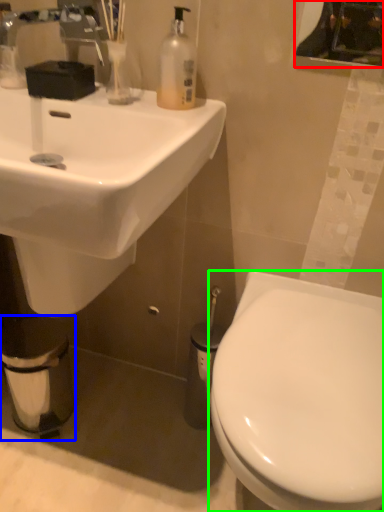
Question: Which object is positioned closest to mirror (highlighted by a red box)? Select from toilet paper (highlighted by a blue box) and toilet (highlighted by a green box).

Choices:
 (A) toilet paper
 (B) toilet

Answer: (B)